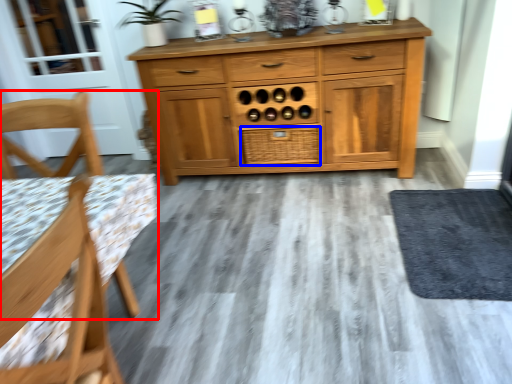
Question: Which object is closer to the camera taking this photo, chair (highlighted by a red box) or drawer (highlighted by a blue box)?

Choices:
 (A) chair
 (B) drawer

Answer: (A)